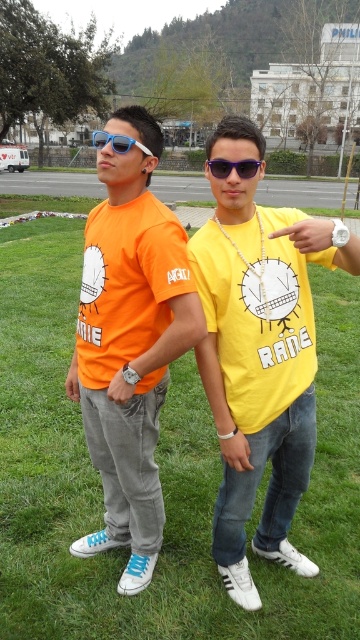
Question: Considering the relative positions of green grass at center and yellow matte shirt at center in the image provided, where is green grass at center located with respect to yellow matte shirt at center?

Choices:
 (A) left
 (B) right

Answer: (A)

Question: Which object appears farthest from the camera in this image?

Choices:
 (A) sunglasses at center
 (B) yellow matte shirt at center
 (C) matte orange t-shirt at center
 (D) green grass at center

Answer: (B)

Question: Which is nearer to the matte orange t-shirt at center?

Choices:
 (A) green grass at center
 (B) yellow matte shirt at center
 (C) sunglasses at center

Answer: (B)

Question: Observing the image, what is the correct spatial positioning of green grass at center in reference to yellow matte shirt at center?

Choices:
 (A) below
 (B) above

Answer: (B)

Question: Is green grass at center positioned before yellow matte shirt at center?

Choices:
 (A) no
 (B) yes

Answer: (B)

Question: Which object is farther from the camera taking this photo?

Choices:
 (A) green grass at center
 (B) sunglasses at center
 (C) matte orange t-shirt at center
 (D) yellow matte shirt at center

Answer: (D)